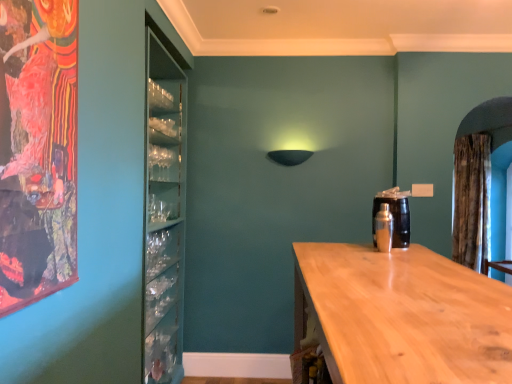
This screenshot has height=384, width=512. What are the coordinates of `silver metallic shaker at right` in the screenshot? It's located at (384, 228).

Identify the location of light wood countertop at center. (403, 315).

Locate an element on the screen. This screenshot has height=384, width=512. brown textured curtain at right is located at coordinates (472, 201).

This screenshot has width=512, height=384. I want to click on silver metallic shaker at right, so click(x=384, y=228).

From the image's perspective, which object appears higher, light wood countertop at center or brown textured curtain at right?

brown textured curtain at right.

Which of these two, light wood countertop at center or brown textured curtain at right, is wider?

light wood countertop at center is wider.

Is light wood countertop at center placed right next to brown textured curtain at right?

There is a gap between light wood countertop at center and brown textured curtain at right.

Which is in front, point (372, 364) or point (489, 183)?

The point (372, 364) is more forward.

Is silver metallic shaker at right positioned far away from light wood countertop at center?

silver metallic shaker at right is actually quite close to light wood countertop at center.

Consider the image. Is silver metallic shaker at right to the left or to the right of light wood countertop at center in the image?

Clearly, silver metallic shaker at right is on the right of light wood countertop at center in the image.

Considering the positions of point (385, 250) and point (384, 258), is point (385, 250) closer or farther from the camera than point (384, 258)?

Clearly, point (385, 250) is more distant from the camera than point (384, 258).

Based on the photo, is silver metallic shaker at right completely or partially outside of light wood countertop at center?

Yes.

Considering the sizes of brown textured curtain at right and light wood countertop at center in the image, is brown textured curtain at right taller or shorter than light wood countertop at center?

brown textured curtain at right is taller than light wood countertop at center.

Is brown textured curtain at right at the right side of light wood countertop at center?

Indeed, brown textured curtain at right is positioned on the right side of light wood countertop at center.

From the image's perspective, which object appears higher, brown textured curtain at right or light wood countertop at center?

brown textured curtain at right is shown above in the image.

Considering the sizes of objects brown textured curtain at right and light wood countertop at center in the image provided, who is smaller, brown textured curtain at right or light wood countertop at center?

brown textured curtain at right.

Does point (463, 229) come in front of point (388, 228)?

No, it is not.

Considering the sizes of brown textured curtain at right and silver metallic shaker at right in the image, is brown textured curtain at right taller or shorter than silver metallic shaker at right?

brown textured curtain at right is taller than silver metallic shaker at right.

Does brown textured curtain at right have a lesser width compared to silver metallic shaker at right?

Incorrect, the width of brown textured curtain at right is not less than that of silver metallic shaker at right.

From a real-world perspective, is brown textured curtain at right physically located above or below silver metallic shaker at right?

In terms of real-world spatial position, brown textured curtain at right is above silver metallic shaker at right.

Considering the relative sizes of light wood countertop at center and silver metallic shaker at right in the image provided, is light wood countertop at center smaller than silver metallic shaker at right?

Actually, light wood countertop at center might be larger than silver metallic shaker at right.

Are light wood countertop at center and silver metallic shaker at right located far from each other?

No, light wood countertop at center is not far away from silver metallic shaker at right.

Could you tell me if light wood countertop at center is facing silver metallic shaker at right?

No, light wood countertop at center is not facing towards silver metallic shaker at right.

From the image's perspective, which is below, silver metallic shaker at right or brown textured curtain at right?

silver metallic shaker at right.

Is silver metallic shaker at right positioned in front of brown textured curtain at right?

Yes, the depth of silver metallic shaker at right is less than that of brown textured curtain at right.

Is silver metallic shaker at right far away from brown textured curtain at right?

That's right, there is a large distance between silver metallic shaker at right and brown textured curtain at right.

Locate an element on the screen. This screenshot has width=512, height=384. curtain above the light wood countertop at center (from a real-world perspective) is located at coordinates (472, 201).

Locate an element on the screen. This screenshot has width=512, height=384. bottle above the light wood countertop at center (from the image's perspective) is located at coordinates (384, 228).

From the image, which object appears to be farther from light wood countertop at center, brown textured curtain at right or silver metallic shaker at right?

Based on the image, brown textured curtain at right appears to be further to light wood countertop at center.

Looking at the image, which one is located further to light wood countertop at center, silver metallic shaker at right or brown textured curtain at right?

brown textured curtain at right is positioned further to the anchor light wood countertop at center.

Based on their spatial positions, is silver metallic shaker at right or light wood countertop at center closer to brown textured curtain at right?

silver metallic shaker at right.

When comparing their distances from silver metallic shaker at right, does brown textured curtain at right or light wood countertop at center seem closer?

light wood countertop at center is positioned closer to the anchor silver metallic shaker at right.

From the picture: Looking at the image, which one is located closer to silver metallic shaker at right, light wood countertop at center or brown textured curtain at right?

light wood countertop at center is positioned closer to the anchor silver metallic shaker at right.

From the image, which object appears to be nearer to brown textured curtain at right, light wood countertop at center or silver metallic shaker at right?

silver metallic shaker at right lies closer to brown textured curtain at right than the other object.

The image size is (512, 384). I want to click on bottle positioned between light wood countertop at center and brown textured curtain at right from near to far, so click(x=384, y=228).